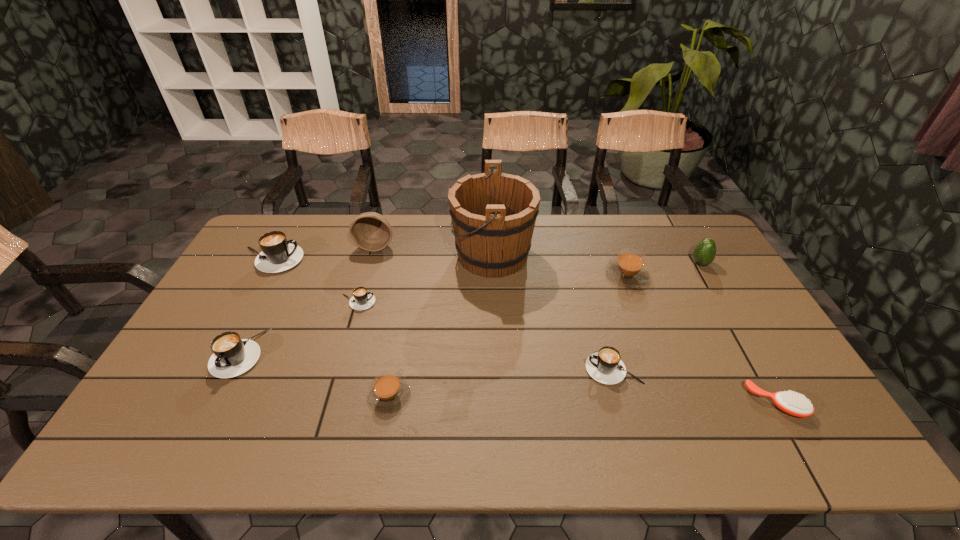
Find the location of a particular element. The height and width of the screenshot is (540, 960). vacant space situated on the back of the bigger brown cappuccino is located at coordinates (612, 235).

Identify the location of vacant space situated with the handle on the side of the third smallest black cappuccino. The width and height of the screenshot is (960, 540). (191, 447).

Where is `vacant region located 0.350m with the handle on the side of the rightmost black cappuccino`? vacant region located 0.350m with the handle on the side of the rightmost black cappuccino is located at coordinates (453, 369).

This screenshot has height=540, width=960. What are the coordinates of `vacant space located 0.080m with the handle on the side of the rightmost black cappuccino` in the screenshot? It's located at (555, 369).

Where is `free location located 0.180m with the handle on the side of the rightmost black cappuccino`? This screenshot has width=960, height=540. free location located 0.180m with the handle on the side of the rightmost black cappuccino is located at coordinates (517, 369).

The width and height of the screenshot is (960, 540). In order to click on vacant area situated 0.280m on the back of the left brown cappuccino in this screenshot , I will do `click(406, 301)`.

Identify the location of free space located with the handle on the side of the third nearest black cappuccino. The image size is (960, 540). (480, 302).

Locate an element on the screen. The height and width of the screenshot is (540, 960). vacant space situated 0.270m on the left of the orange hairbrush is located at coordinates (640, 403).

Where is `wine bucket that is at the far edge`? The width and height of the screenshot is (960, 540). wine bucket that is at the far edge is located at coordinates (493, 214).

Find the location of a particular element. The image size is (960, 540). bowl at the far edge is located at coordinates (371, 231).